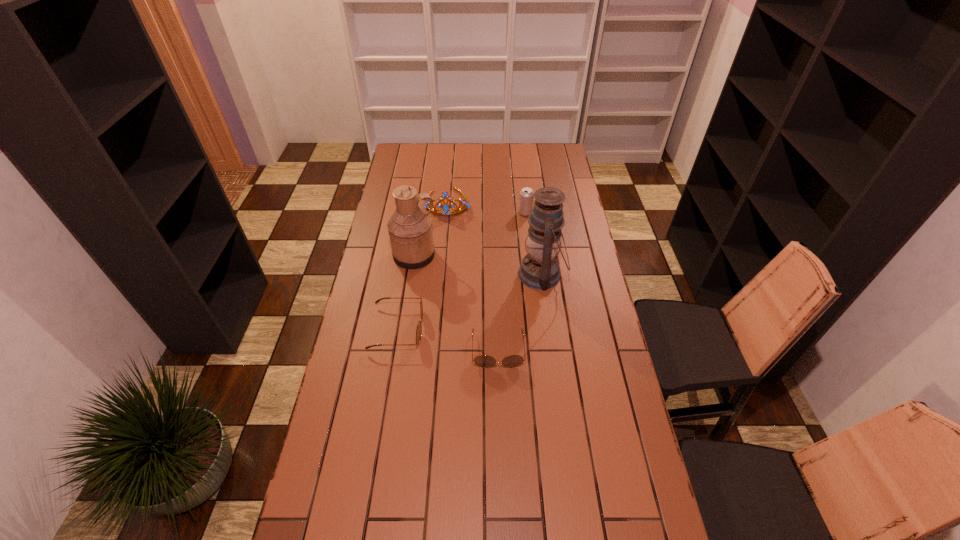
This screenshot has height=540, width=960. I want to click on vacant place for an extra sunglasses on the right, so click(608, 373).